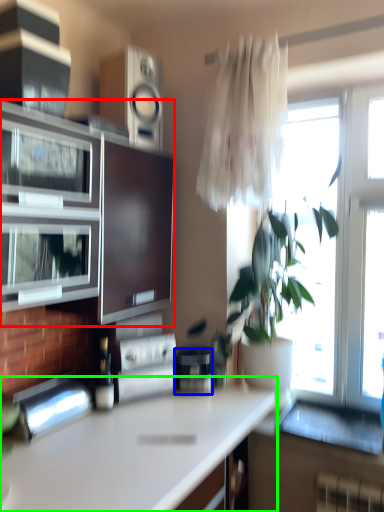
Question: Based on their relative distances, which object is nearer to cabinetry (highlighted by a red box)? Choose from appliance (highlighted by a blue box) and countertop (highlighted by a green box).

Choices:
 (A) appliance
 (B) countertop

Answer: (B)